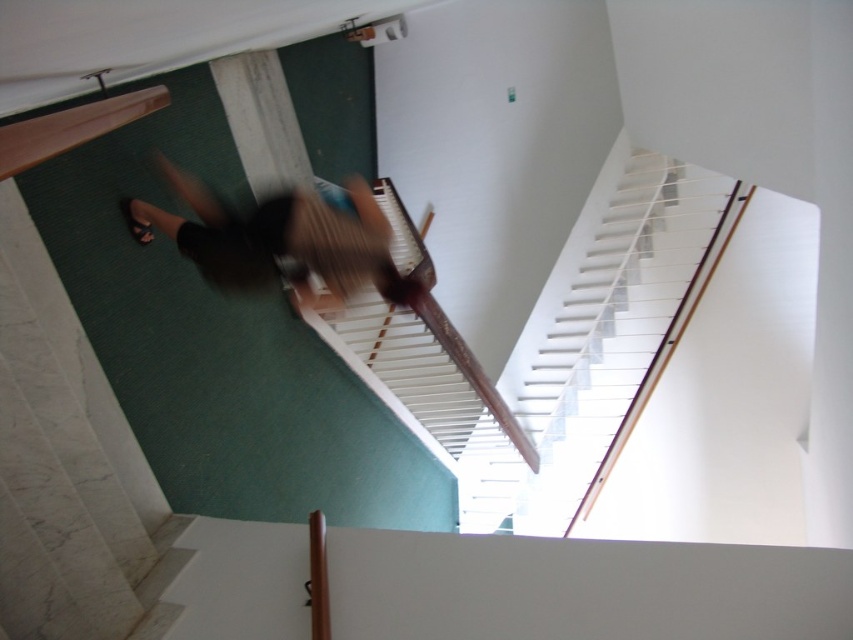
Based on the photo, you are standing on the upper floor and want to go down the stairs. You see the white wooden stairs at upper center and the blurred black shorts at center. Which direction should you move to reach the stairs?

You should move downward towards the white wooden stairs at upper center because it is located below the blurred black shorts at center, which means the stairs are beneath your current position.

You are standing at the bottom of the staircase in the image and want to reach a point that is closer to you. Which point should you head towards, point (541, 516) or point (283, 227)?

Point (283, 227) is closer to you because it is less further to the viewer than point (541, 516).